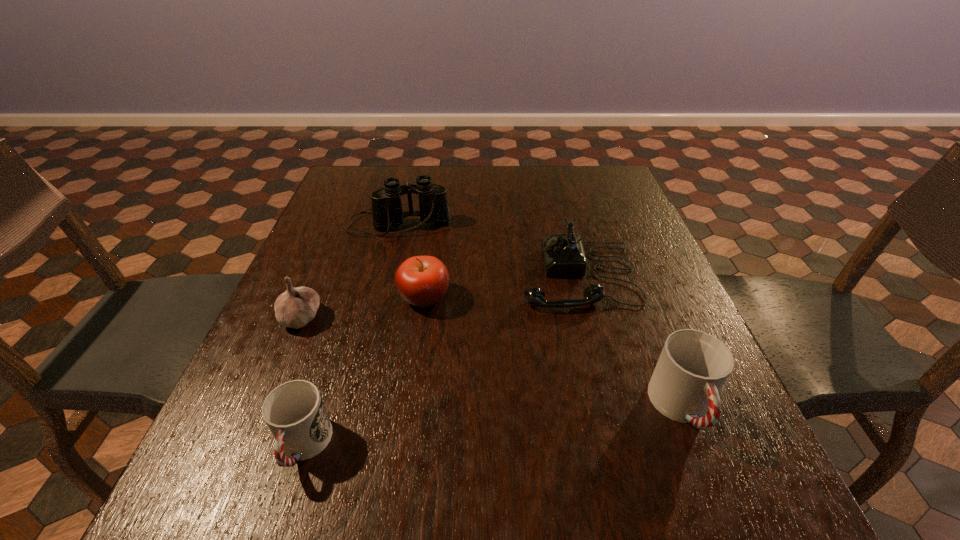
The height and width of the screenshot is (540, 960). In the image, there is a desktop. Identify the location of vacant region at the near edge. (482, 440).

Where is `free space at the left edge of the desktop`? free space at the left edge of the desktop is located at coordinates (319, 385).

Where is `free space at the right edge of the desktop`? This screenshot has height=540, width=960. free space at the right edge of the desktop is located at coordinates (662, 274).

Identify the location of vacant area at the far left corner of the desktop. Image resolution: width=960 pixels, height=540 pixels. (356, 174).

At what (x,y) coordinates should I click in order to perform the action: click on vacant space at the far right corner. Please return your answer as a coordinate pair (x, y). This screenshot has height=540, width=960. Looking at the image, I should click on (605, 193).

Find the location of a particular element. The height and width of the screenshot is (540, 960). unoccupied position between the right cup and the apple is located at coordinates (553, 353).

Identify the location of vacant area between the apple and the garlic. The width and height of the screenshot is (960, 540). (363, 307).

Where is `vacant space that's between the telephone and the shorter cup`? Image resolution: width=960 pixels, height=540 pixels. vacant space that's between the telephone and the shorter cup is located at coordinates (441, 361).

This screenshot has width=960, height=540. What are the coordinates of `free point between the binoculars and the garlic` in the screenshot? It's located at (349, 271).

This screenshot has width=960, height=540. In order to click on free space that is in between the apple and the telephone in this screenshot , I will do `click(501, 286)`.